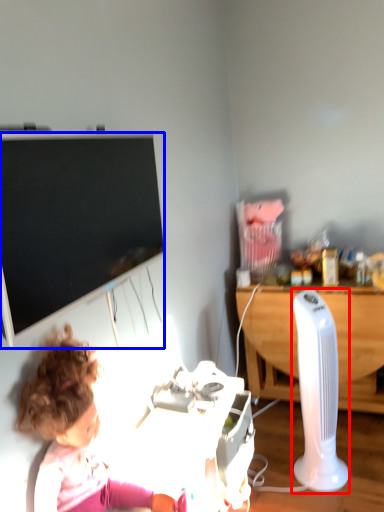
Question: Among these objects, which one is farthest to the camera, equipment (highlighted by a red box) or television (highlighted by a blue box)?

Choices:
 (A) equipment
 (B) television

Answer: (A)